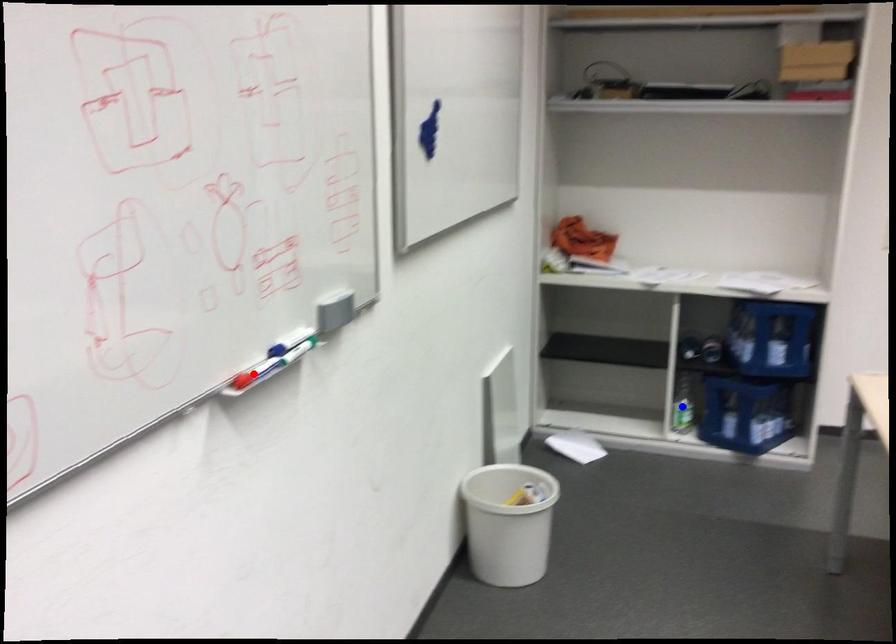
Question: In the image, two points are highlighted. Which point is nearer to the camera? Reply with the corresponding letter.

Choices:
 (A) blue point
 (B) red point

Answer: (B)